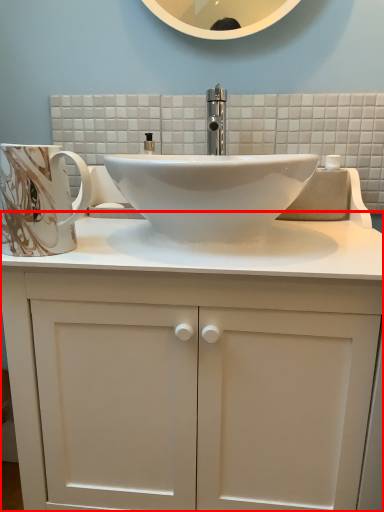
Question: Observing the image, what is the correct spatial positioning of bathroom cabinet (annotated by the red box) in reference to mug?

Choices:
 (A) right
 (B) left

Answer: (A)